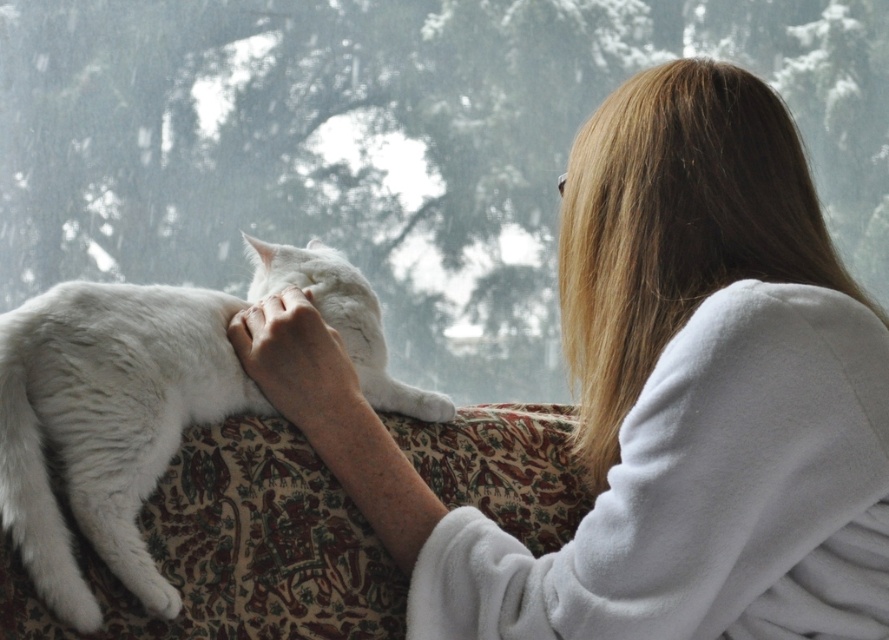
Question: From the image, what is the correct spatial relationship of white fluffy robe at upper right in relation to white fluffy cat at center?

Choices:
 (A) left
 (B) right

Answer: (B)

Question: Which of the following is the closest to the observer?

Choices:
 (A) white fluffy robe at upper right
 (B) white fluffy cat at center

Answer: (A)

Question: Does white fluffy robe at upper right appear on the left side of white fluffy cat at center?

Choices:
 (A) yes
 (B) no

Answer: (B)

Question: Is white fluffy robe at upper right wider than white fluffy cat at center?

Choices:
 (A) yes
 (B) no

Answer: (A)